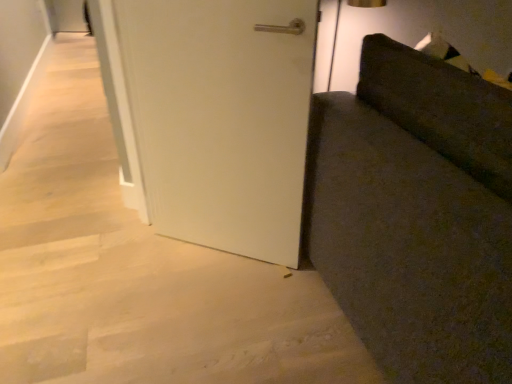
Question: Is white matte door at center positioned with its back to dark fabric couch at right?

Choices:
 (A) no
 (B) yes

Answer: (A)

Question: Can you confirm if white matte door at center is bigger than dark fabric couch at right?

Choices:
 (A) no
 (B) yes

Answer: (A)

Question: Does white matte door at center have a smaller size compared to dark fabric couch at right?

Choices:
 (A) yes
 (B) no

Answer: (A)

Question: Would you say white matte door at center contains dark fabric couch at right?

Choices:
 (A) yes
 (B) no

Answer: (B)

Question: From the image's perspective, would you say white matte door at center is positioned over dark fabric couch at right?

Choices:
 (A) no
 (B) yes

Answer: (B)

Question: Is white matte door at center aimed at dark fabric couch at right?

Choices:
 (A) yes
 (B) no

Answer: (B)

Question: From a real-world perspective, is dark fabric couch at right physically below white matte door at center?

Choices:
 (A) yes
 (B) no

Answer: (A)

Question: Can you confirm if dark fabric couch at right is smaller than white matte door at center?

Choices:
 (A) no
 (B) yes

Answer: (A)

Question: Does dark fabric couch at right have a greater width compared to white matte door at center?

Choices:
 (A) no
 (B) yes

Answer: (B)

Question: Would you say dark fabric couch at right is outside white matte door at center?

Choices:
 (A) no
 (B) yes

Answer: (B)

Question: Is dark fabric couch at right not close to white matte door at center?

Choices:
 (A) no
 (B) yes

Answer: (A)

Question: Would you say white matte door at center is part of dark fabric couch at right's contents?

Choices:
 (A) no
 (B) yes

Answer: (A)

Question: In terms of width, does white matte door at center look wider or thinner when compared to dark fabric couch at right?

Choices:
 (A) wide
 (B) thin

Answer: (B)